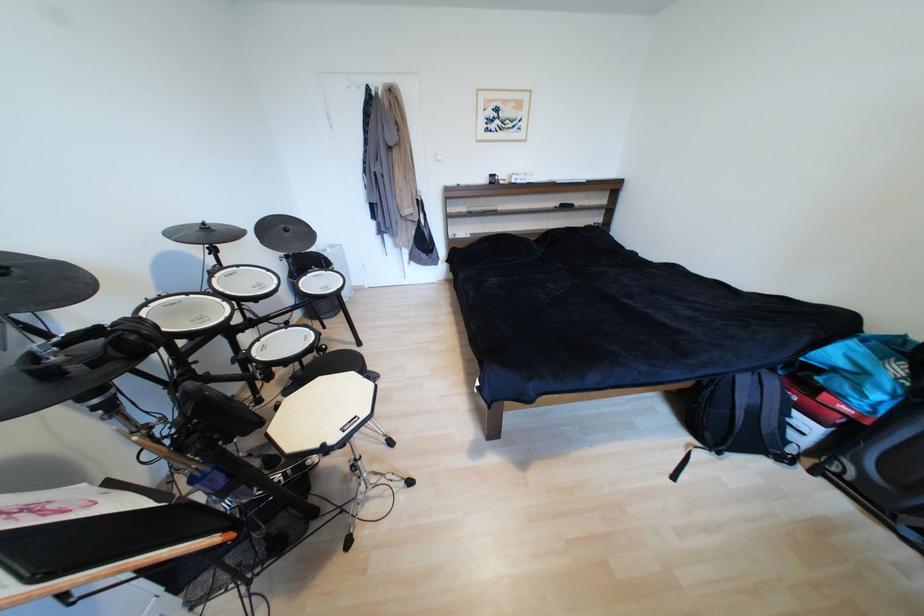
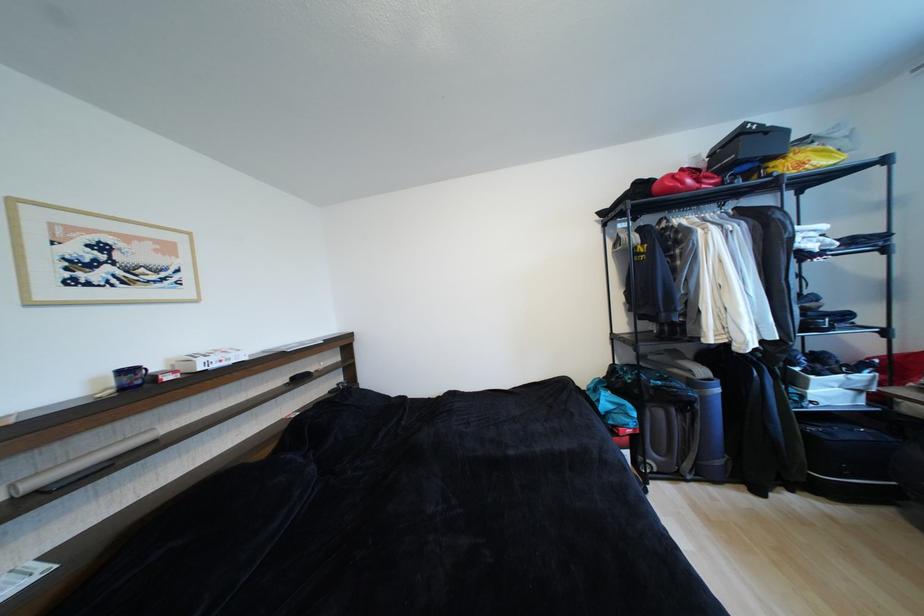
Find the pixel in the second image that matches pixel 526 177 in the first image.

(219, 360)